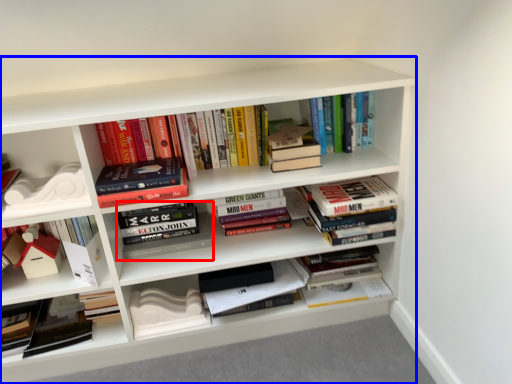
Question: Which object appears closest to the camera in this image, book (highlighted by a red box) or shelf (highlighted by a blue box)?

Choices:
 (A) book
 (B) shelf

Answer: (B)